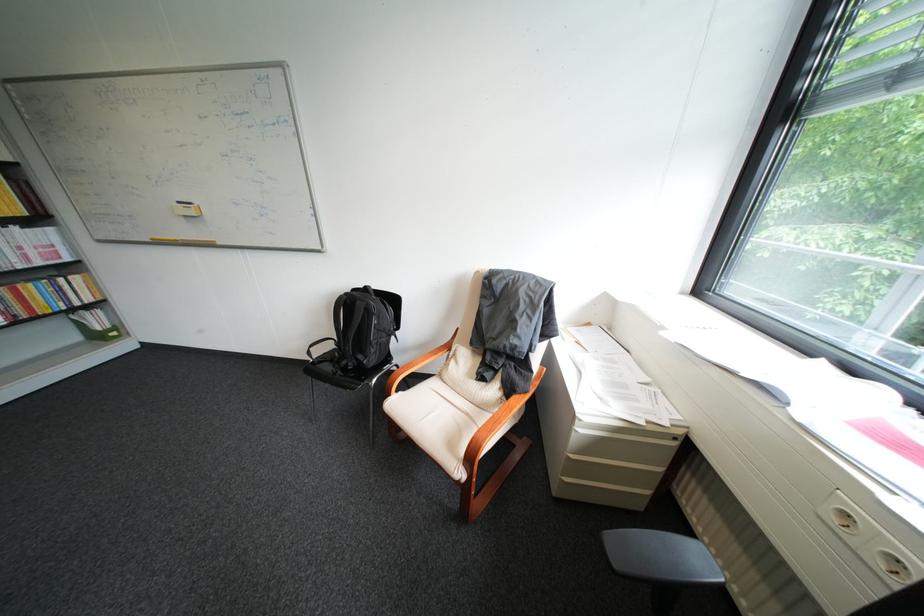
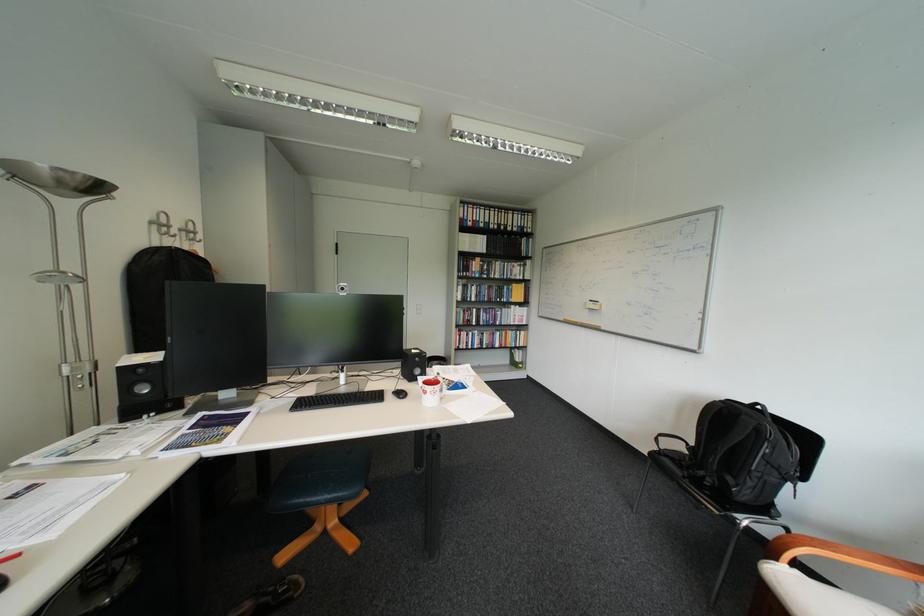
In the second image, find the point that corresponds to point 402,395 in the first image.

(788, 560)